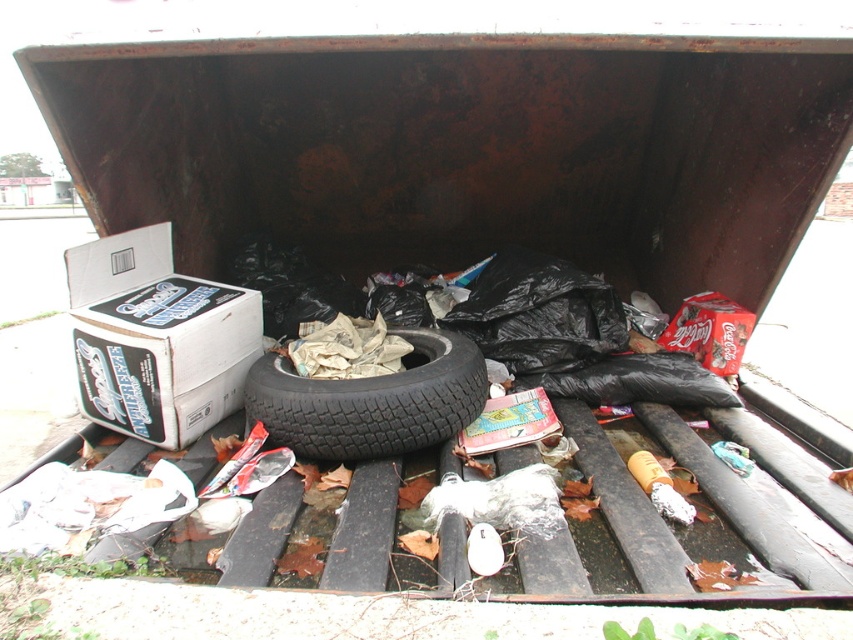
Question: Which point is closer to the camera?

Choices:
 (A) black rubber tire at center
 (B) white cardboard box at left

Answer: (A)

Question: Does white cardboard box at left come in front of black rubber tire at center?

Choices:
 (A) no
 (B) yes

Answer: (A)

Question: Does white cardboard box at left come in front of black rubber tire at center?

Choices:
 (A) no
 (B) yes

Answer: (A)

Question: Does white cardboard box at left come in front of black rubber tire at center?

Choices:
 (A) yes
 (B) no

Answer: (B)